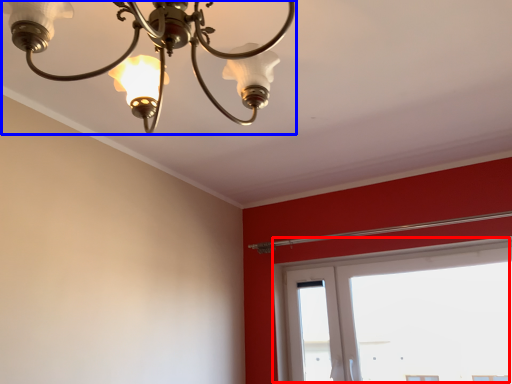
Question: Which object is further to the camera taking this photo, window (highlighted by a red box) or lamp (highlighted by a blue box)?

Choices:
 (A) window
 (B) lamp

Answer: (A)